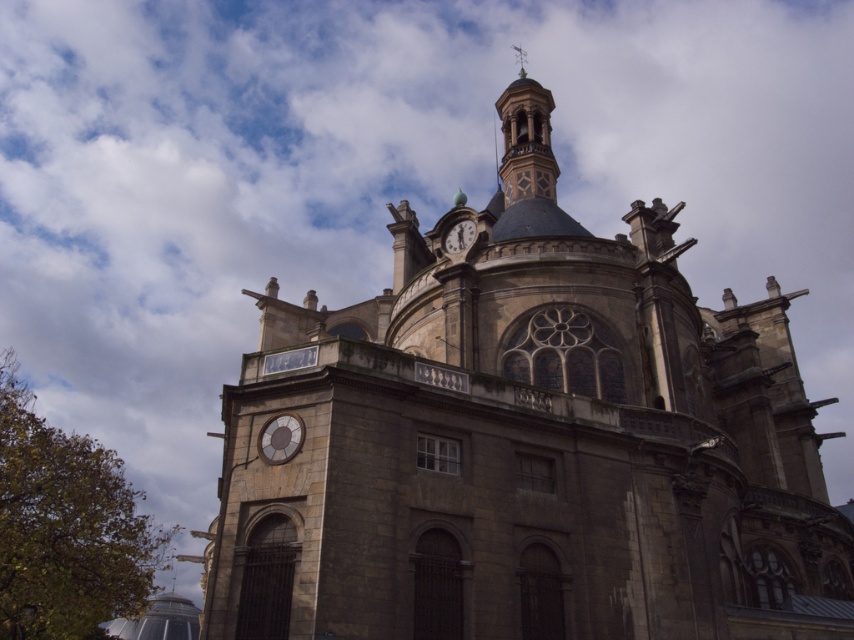
Which of these two, stone church at center or matte stone clock at upper center, stands shorter?

matte stone clock at upper center is shorter.

Who is more distant from viewer, (260, 426) or (468, 236)?

Point (468, 236)

Is point (753, 596) farther from viewer compared to point (453, 234)?

No, (753, 596) is in front of (453, 234).

Find the location of a particular element. The height and width of the screenshot is (640, 854). stone church at center is located at coordinates (527, 449).

Based on the photo, is the position of stone church at center more distant than that of smooth stone clock tower at upper center?

No.

Who is taller, stone church at center or smooth stone clock tower at upper center?

Standing taller between the two is smooth stone clock tower at upper center.

Is point (793, 404) positioned in front of point (525, 196)?

No, (793, 404) is further to viewer.

Find the location of `stone church at center`. stone church at center is located at coordinates [x=527, y=449].

Which of these two, stone church at center or matte gray clock at lower left, stands taller?

stone church at center is taller.

The height and width of the screenshot is (640, 854). What do you see at coordinates (527, 449) in the screenshot?
I see `stone church at center` at bounding box center [527, 449].

Which is in front, point (259, 600) or point (272, 417)?

Point (259, 600) is more forward.

The width and height of the screenshot is (854, 640). Identify the location of stone church at center. (527, 449).